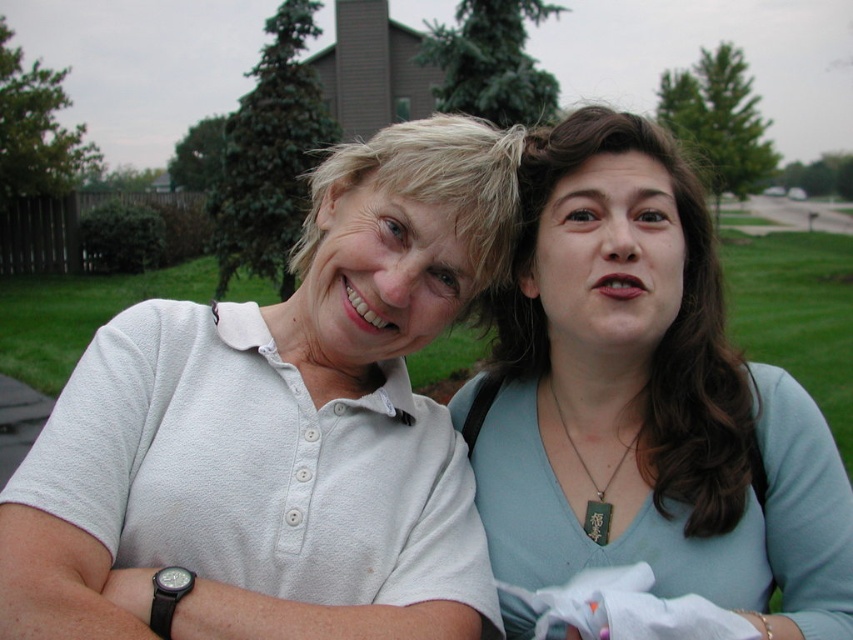
Question: Is white matte shirt at left smaller than matte white shirt at upper left?

Choices:
 (A) yes
 (B) no

Answer: (B)

Question: Which point is farther from the camera taking this photo?

Choices:
 (A) (599, 515)
 (B) (126, 556)

Answer: (A)

Question: Can you confirm if white matte shirt at left is positioned to the left of matte white shirt at upper left?

Choices:
 (A) no
 (B) yes

Answer: (B)

Question: Which object is closer to the camera taking this photo?

Choices:
 (A) white matte shirt at left
 (B) matte white shirt at upper left

Answer: (A)

Question: Considering the relative positions of white matte shirt at left and matte white shirt at upper left in the image provided, where is white matte shirt at left located with respect to matte white shirt at upper left?

Choices:
 (A) left
 (B) right

Answer: (A)